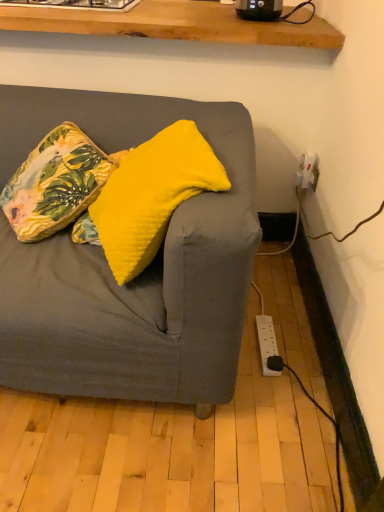
Question: Does floral fabric cushion at upper left, acting as the first pillow starting from the left, have a greater width compared to yellow soft cushion at center, which is the 2th pillow in left-to-right order?

Choices:
 (A) yes
 (B) no

Answer: (A)

Question: Is floral fabric cushion at upper left, acting as the first pillow starting from the left, in contact with yellow soft cushion at center, which is the 2th pillow in left-to-right order?

Choices:
 (A) no
 (B) yes

Answer: (A)

Question: Is floral fabric cushion at upper left, which is the second pillow in right-to-left order, not near yellow soft cushion at center, arranged as the 1th pillow when viewed from the right?

Choices:
 (A) no
 (B) yes

Answer: (A)

Question: Considering the relative sizes of floral fabric cushion at upper left, acting as the first pillow starting from the left, and yellow soft cushion at center, which is the 2th pillow in left-to-right order, in the image provided, is floral fabric cushion at upper left, acting as the first pillow starting from the left, shorter than yellow soft cushion at center, which is the 2th pillow in left-to-right order,?

Choices:
 (A) yes
 (B) no

Answer: (A)

Question: Is floral fabric cushion at upper left, acting as the first pillow starting from the left, at the left side of yellow soft cushion at center, arranged as the 1th pillow when viewed from the right?

Choices:
 (A) no
 (B) yes

Answer: (B)

Question: Is floral fabric cushion at upper left, acting as the first pillow starting from the left, facing towards yellow soft cushion at center, which is the 2th pillow in left-to-right order?

Choices:
 (A) yes
 (B) no

Answer: (B)

Question: From a real-world perspective, is yellow soft cushion at center, which is the 2th pillow in left-to-right order, positioned under floral fabric cushion at upper left, which is the second pillow in right-to-left order, based on gravity?

Choices:
 (A) no
 (B) yes

Answer: (A)

Question: From a real-world perspective, is yellow soft cushion at center, which is the 2th pillow in left-to-right order, positioned over floral fabric cushion at upper left, acting as the first pillow starting from the left, based on gravity?

Choices:
 (A) yes
 (B) no

Answer: (A)

Question: Can you confirm if yellow soft cushion at center, which is the 2th pillow in left-to-right order, is thinner than floral fabric cushion at upper left, which is the second pillow in right-to-left order?

Choices:
 (A) yes
 (B) no

Answer: (A)

Question: From the image's perspective, is yellow soft cushion at center, which is the 2th pillow in left-to-right order, under floral fabric cushion at upper left, which is the second pillow in right-to-left order?

Choices:
 (A) no
 (B) yes

Answer: (B)

Question: Is yellow soft cushion at center, which is the 2th pillow in left-to-right order, turned away from floral fabric cushion at upper left, which is the second pillow in right-to-left order?

Choices:
 (A) yes
 (B) no

Answer: (B)

Question: Is yellow soft cushion at center, arranged as the 1th pillow when viewed from the right, with floral fabric cushion at upper left, acting as the first pillow starting from the left?

Choices:
 (A) yes
 (B) no

Answer: (B)

Question: Is yellow soft cushion at center, arranged as the 1th pillow when viewed from the right, spatially inside floral fabric cushion at upper left, acting as the first pillow starting from the left, or outside of it?

Choices:
 (A) inside
 (B) outside

Answer: (B)